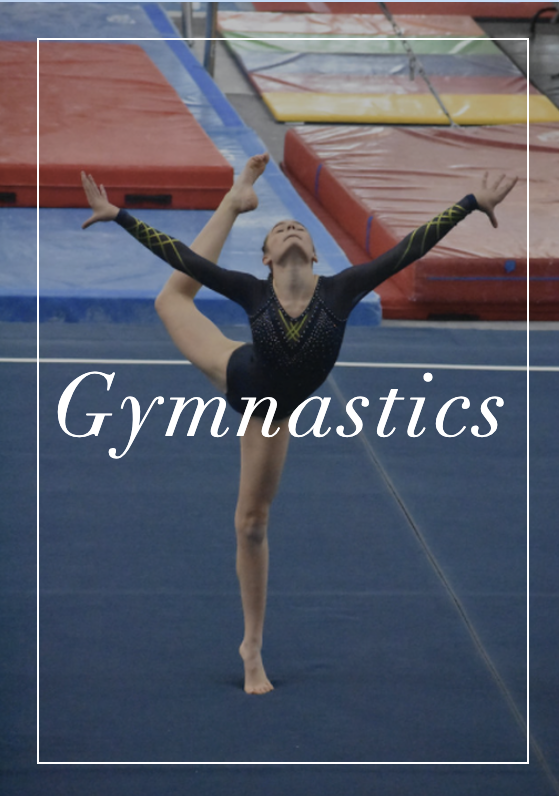
At what (x,y) coordinates should I click in order to perform the action: click on red mats. Please return your answer as a coordinate pair (x, y). Looking at the image, I should click on (125, 138), (345, 82), (352, 21), (498, 10), (411, 186), (400, 310), (181, 196).